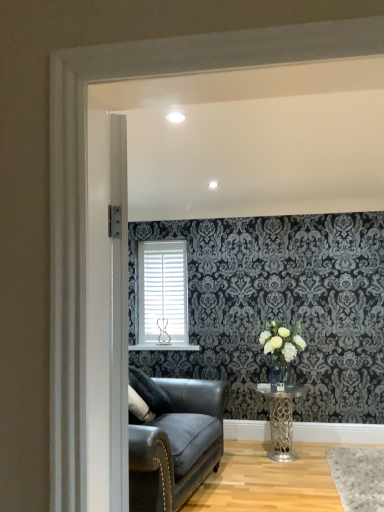
Question: Is metallic silver table at lower center in contact with white matte blinds at center?

Choices:
 (A) yes
 (B) no

Answer: (B)

Question: Would you say metallic silver table at lower center is outside white matte blinds at center?

Choices:
 (A) no
 (B) yes

Answer: (B)

Question: Considering the relative sizes of metallic silver table at lower center and white matte blinds at center in the image provided, is metallic silver table at lower center taller than white matte blinds at center?

Choices:
 (A) yes
 (B) no

Answer: (B)

Question: From a real-world perspective, is metallic silver table at lower center physically below white matte blinds at center?

Choices:
 (A) no
 (B) yes

Answer: (B)

Question: Considering the relative positions of metallic silver table at lower center and white matte blinds at center in the image provided, is metallic silver table at lower center in front of white matte blinds at center?

Choices:
 (A) yes
 (B) no

Answer: (A)

Question: From the image's perspective, does metallic silver table at lower center appear higher than white matte blinds at center?

Choices:
 (A) no
 (B) yes

Answer: (A)

Question: Does clear glass vase at center come in front of metallic silver table at lower center?

Choices:
 (A) no
 (B) yes

Answer: (A)

Question: Is clear glass vase at center surrounding metallic silver table at lower center?

Choices:
 (A) yes
 (B) no

Answer: (B)

Question: Considering the relative sizes of clear glass vase at center and metallic silver table at lower center in the image provided, is clear glass vase at center wider than metallic silver table at lower center?

Choices:
 (A) yes
 (B) no

Answer: (B)

Question: Can you confirm if clear glass vase at center is taller than metallic silver table at lower center?

Choices:
 (A) no
 (B) yes

Answer: (A)

Question: Considering the relative positions of clear glass vase at center and metallic silver table at lower center in the image provided, is clear glass vase at center behind metallic silver table at lower center?

Choices:
 (A) no
 (B) yes

Answer: (B)

Question: Does clear glass vase at center have a smaller size compared to metallic silver table at lower center?

Choices:
 (A) no
 (B) yes

Answer: (B)

Question: Is metallic silver table at lower center with white matte vase at center-right?

Choices:
 (A) no
 (B) yes

Answer: (A)